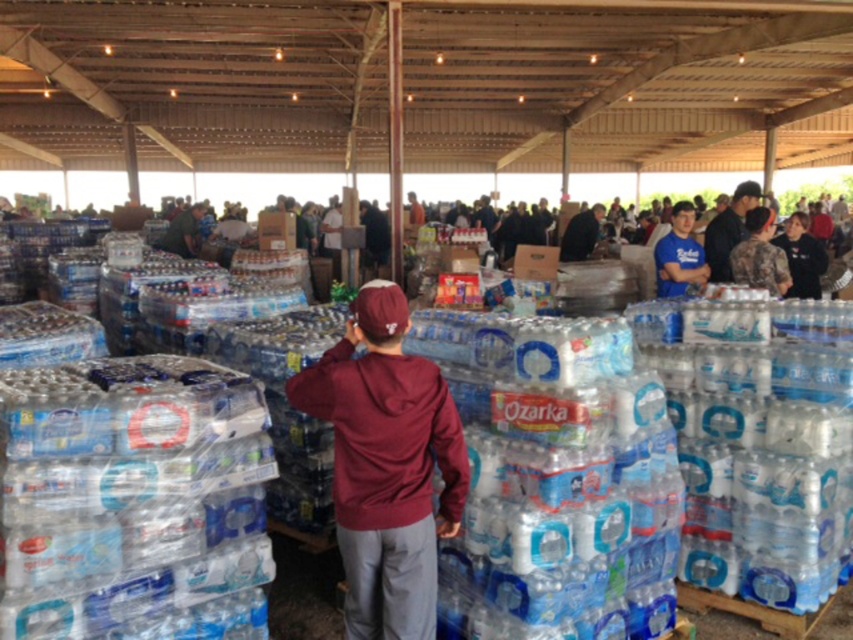
Question: Among these points, which one is nearest to the camera?

Choices:
 (A) (763, 253)
 (B) (418, 385)
 (C) (677, 228)

Answer: (B)

Question: Can you confirm if maroon hoodie at center is bigger than camouflage uniform at right?

Choices:
 (A) no
 (B) yes

Answer: (B)

Question: Is maroon hoodie at center below camouflage uniform at right?

Choices:
 (A) yes
 (B) no

Answer: (A)

Question: Which point is closer to the camera?

Choices:
 (A) blue cotton shirt at upper right
 (B) maroon hoodie at center
 (C) camouflage uniform at right

Answer: (B)

Question: Does maroon hoodie at center appear on the left side of camouflage uniform at right?

Choices:
 (A) no
 (B) yes

Answer: (B)

Question: Which of these objects is positioned closest to the maroon hoodie at center?

Choices:
 (A) camouflage uniform at right
 (B) blue cotton shirt at upper right

Answer: (B)